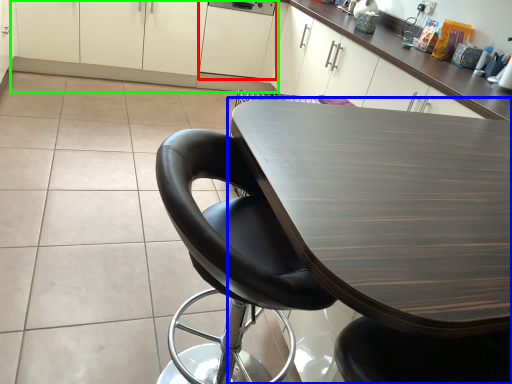
Question: Which is farther away from cabinetry (highlighted by a red box)? table (highlighted by a blue box) or cabinetry (highlighted by a green box)?

Choices:
 (A) table
 (B) cabinetry

Answer: (A)